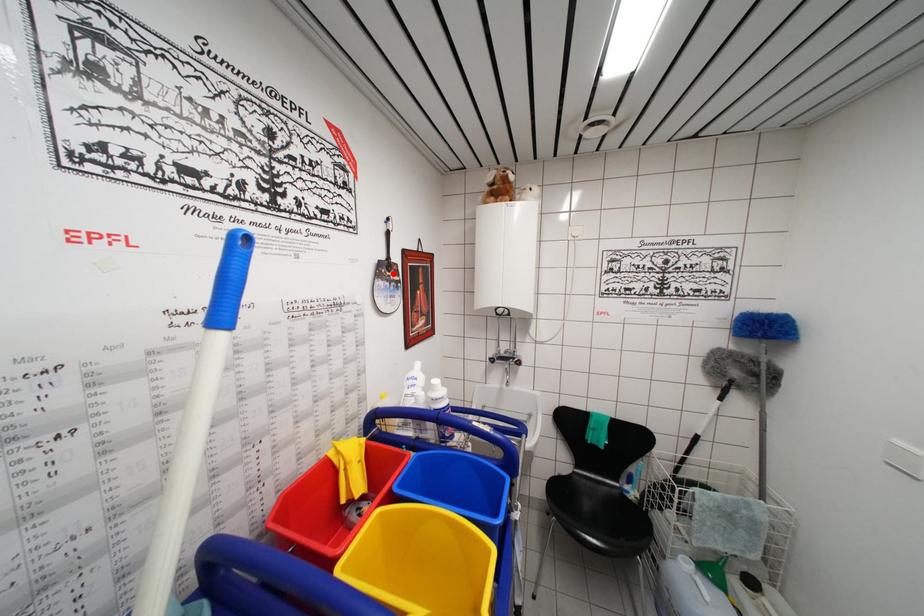
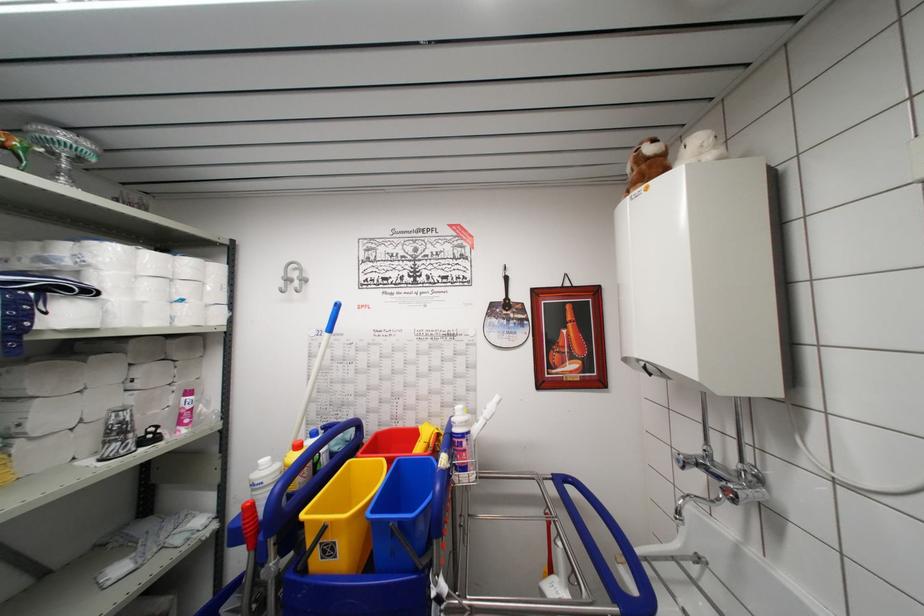
Question: I am providing you with two images of the same scene from different viewpoints. A red point is marked on the first image. At the location where the point appears in image 1, is it still visible in image 2?

Choices:
 (A) Yes
 (B) No

Answer: (A)